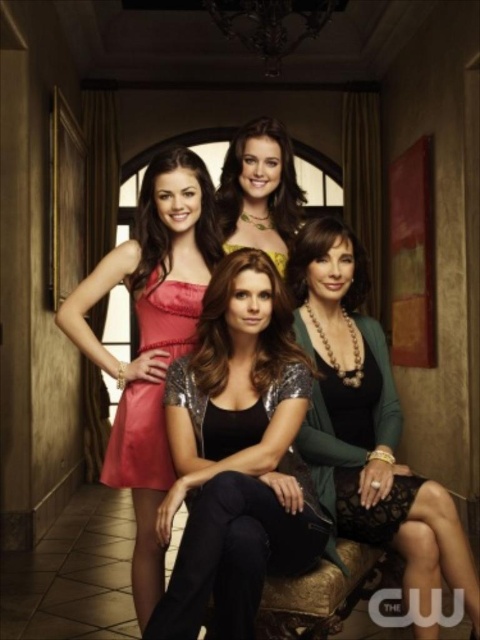
In the scene shown: Can you confirm if satin dress at left is shorter than matte gold necklace at center?

Incorrect, satin dress at left's height does not fall short of matte gold necklace at center's.

Which is in front, point (136, 404) or point (240, 234)?

Point (136, 404)

The width and height of the screenshot is (480, 640). Describe the element at coordinates (151, 339) in the screenshot. I see `satin dress at left` at that location.

Locate an element on the screen. satin dress at left is located at coordinates (151, 339).

Who is higher up, shiny silver sequin top at center or matte gold necklace at center?

matte gold necklace at center is above.

Is shiny silver sequin top at center wider than matte gold necklace at center?

Yes, shiny silver sequin top at center is wider than matte gold necklace at center.

This screenshot has width=480, height=640. What do you see at coordinates (237, 449) in the screenshot?
I see `shiny silver sequin top at center` at bounding box center [237, 449].

Where is `shiny silver sequin top at center`? This screenshot has height=640, width=480. shiny silver sequin top at center is located at coordinates (237, 449).

How far apart are shiny silver sequin top at center and green textured cardigan at center?

The distance of shiny silver sequin top at center from green textured cardigan at center is 13.74 inches.

Is shiny silver sequin top at center thinner than green textured cardigan at center?

Yes, shiny silver sequin top at center is thinner than green textured cardigan at center.

Identify the location of shiny silver sequin top at center. (237, 449).

Locate an element on the screen. Image resolution: width=480 pixels, height=640 pixels. shiny silver sequin top at center is located at coordinates 237,449.